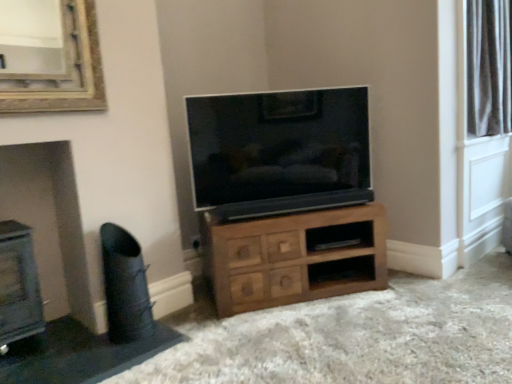
Locate an element on the screen. vacant point to the right of black leather swivel chair at lower left is located at coordinates (161, 338).